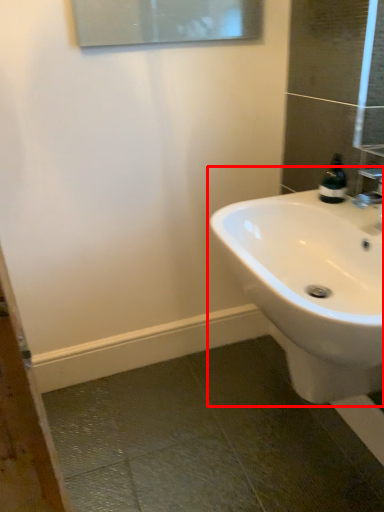
Question: From the image's perspective, where is sink (annotated by the red box) located relative to soap dispenser?

Choices:
 (A) below
 (B) above

Answer: (A)